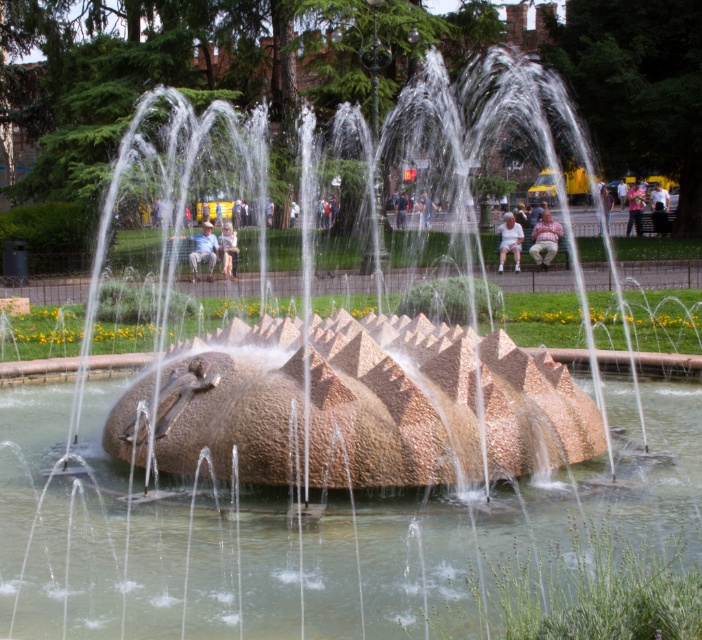
Question: Which point appears farthest from the camera in this image?

Choices:
 (A) (516, 257)
 (B) (548, 256)
 (C) (237, 259)
 (D) (625, 195)

Answer: (D)

Question: Which of the following is the farthest from the observer?

Choices:
 (A) light pink fabric at center
 (B) light brown textured fabric at center
 (C) translucent stone water at center

Answer: (A)

Question: Is white cotton shirt at center positioned at the back of light pink fabric at center?

Choices:
 (A) no
 (B) yes

Answer: (A)

Question: Does translucent stone water at center lie in front of white cotton shirt at center?

Choices:
 (A) no
 (B) yes

Answer: (B)

Question: Which object is closer to the camera taking this photo?

Choices:
 (A) light beige fabric bench at center
 (B) white cotton shirt at center
 (C) light brown textured fabric at center

Answer: (B)

Question: Does white cotton shirt at center have a greater width compared to light beige fabric bench at center?

Choices:
 (A) no
 (B) yes

Answer: (B)